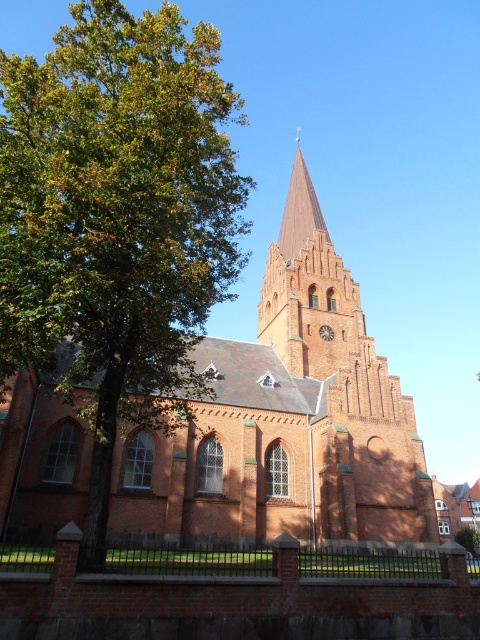
Can you confirm if smooth red brick spire at center is bigger than brick clock at center?

Yes.

The image size is (480, 640). Find the location of `smooth red brick spire at center`. smooth red brick spire at center is located at coordinates (300, 211).

Where is `smooth red brick spire at center`? The image size is (480, 640). smooth red brick spire at center is located at coordinates (300, 211).

Does green leafy tree at left appear on the left side of red brick church steeple at center?

Indeed, green leafy tree at left is positioned on the left side of red brick church steeple at center.

I want to click on green leafy tree at left, so click(x=117, y=220).

Locate an element on the screen. green leafy tree at left is located at coordinates (117, 220).

Between point (300, 323) and point (305, 208), which one is positioned in front?

Positioned in front is point (300, 323).

Can you confirm if red brick church steeple at center is positioned to the left of smooth red brick spire at center?

Correct, you'll find red brick church steeple at center to the left of smooth red brick spire at center.

Between point (423, 532) and point (290, 236), which one is positioned behind?

The point (290, 236) is behind.

The height and width of the screenshot is (640, 480). In order to click on red brick church steeple at center in this screenshot , I will do coord(343,384).